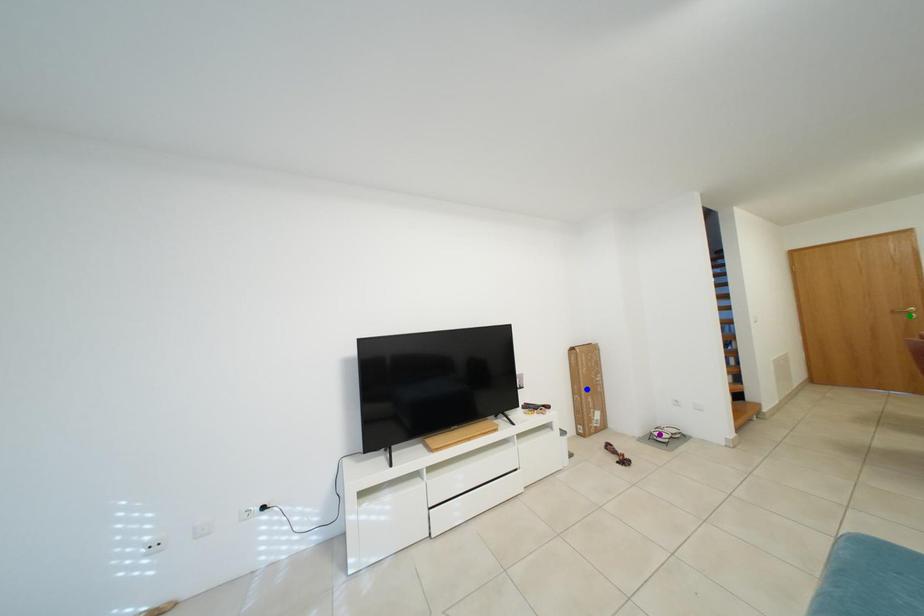
Order these from nearest to farthest:
A) green point
B) blue point
C) purple point

purple point
blue point
green point